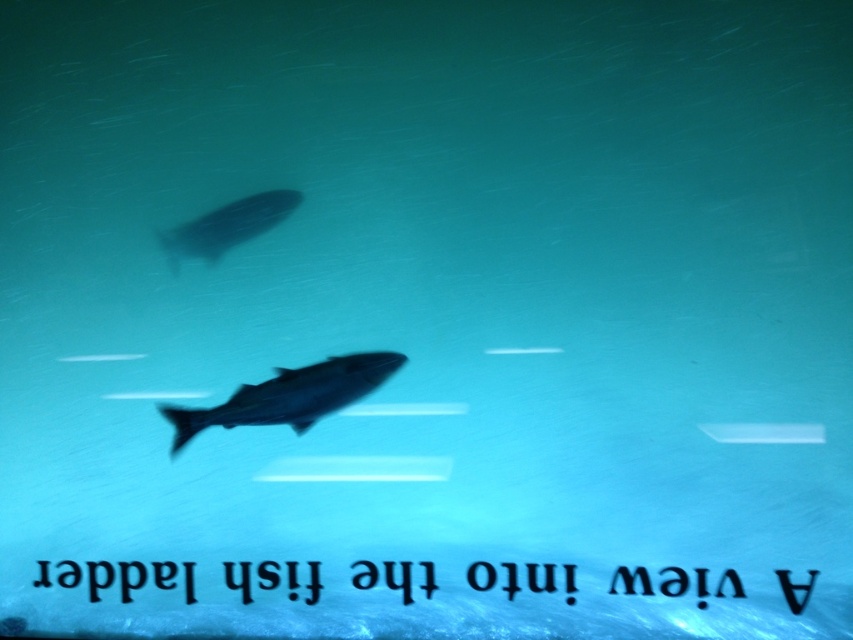
Question: Can you confirm if silvery metallic fish at center is bigger than silvery metallic fish at upper center?

Choices:
 (A) no
 (B) yes

Answer: (B)

Question: Does silvery metallic fish at center appear on the left side of silvery metallic fish at upper center?

Choices:
 (A) yes
 (B) no

Answer: (B)

Question: Which of the following is the closest to the observer?

Choices:
 (A) (184, 237)
 (B) (376, 387)

Answer: (B)

Question: From the image, what is the correct spatial relationship of silvery metallic fish at center in relation to silvery metallic fish at upper center?

Choices:
 (A) below
 (B) above

Answer: (A)

Question: Which point appears closest to the camera in this image?

Choices:
 (A) pyautogui.click(x=242, y=237)
 (B) pyautogui.click(x=300, y=429)

Answer: (B)

Question: Which of the following is the closest to the observer?

Choices:
 (A) silvery metallic fish at upper center
 (B) silvery metallic fish at center

Answer: (B)